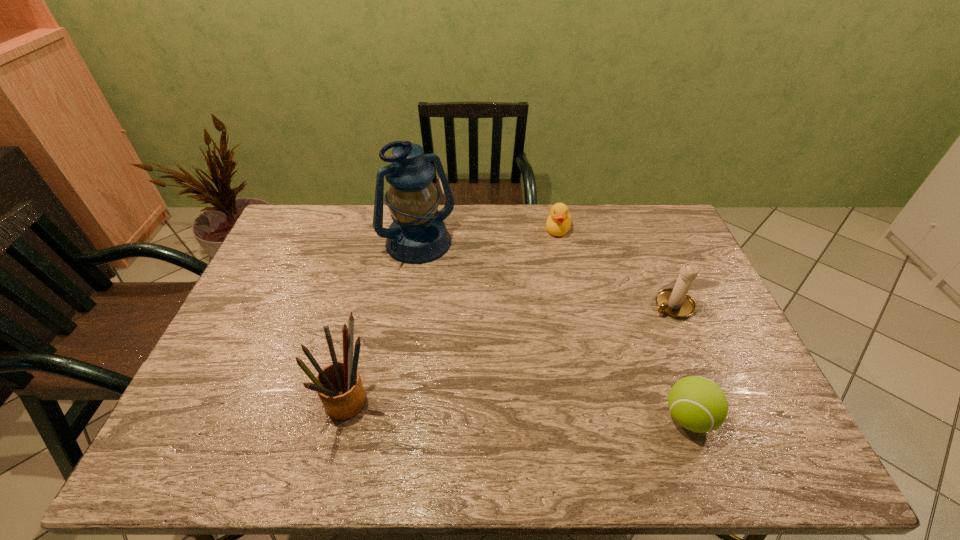
At what (x,y) coordinates should I click in order to perform the action: click on the second tallest object. Please return your answer as a coordinate pair (x, y). The image size is (960, 540). Looking at the image, I should click on (339, 386).

Where is `tennis ball`? This screenshot has width=960, height=540. tennis ball is located at coordinates (698, 404).

This screenshot has width=960, height=540. I want to click on the third nearest object, so click(676, 303).

The height and width of the screenshot is (540, 960). I want to click on candle holder, so click(676, 303).

The width and height of the screenshot is (960, 540). In order to click on the tallest object in this screenshot , I will do `click(417, 234)`.

Where is `duckling`? The image size is (960, 540). duckling is located at coordinates (558, 222).

I want to click on free spot located 0.070m on the right of the pencil box, so click(x=405, y=407).

Find the location of `vacant space located 0.210m on the left of the tennis ball`. vacant space located 0.210m on the left of the tennis ball is located at coordinates (576, 417).

Locate an element on the screen. This screenshot has height=540, width=960. vacant region located 0.320m on the handle side of the third nearest object is located at coordinates point(579,364).

You are a GUI agent. You are given a task and a screenshot of the screen. Output one action in this format:
    pyautogui.click(x=<x>, y=<y>)
    Task: Click on the vacant position located on the handle side of the third nearest object
    The height and width of the screenshot is (540, 960).
    Given the screenshot: What is the action you would take?
    pyautogui.click(x=640, y=326)